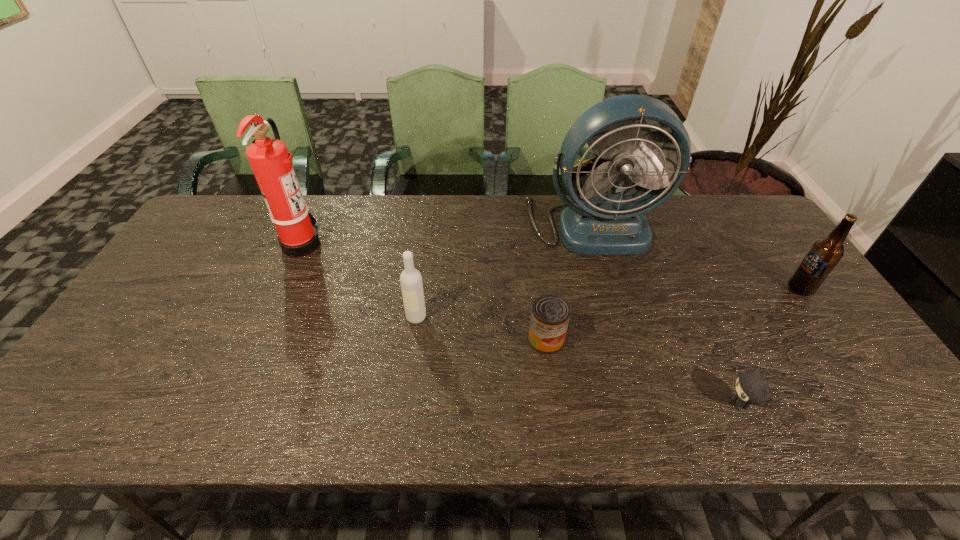
Where is `free spot located at the nozzle of the fire extinguisher`? The width and height of the screenshot is (960, 540). free spot located at the nozzle of the fire extinguisher is located at coordinates (410, 244).

What are the coordinates of `free space located 0.160m on the label of the rightmost object` in the screenshot? It's located at tap(731, 289).

This screenshot has width=960, height=540. Find the location of `blank space located 0.270m on the label of the rightmost object`. blank space located 0.270m on the label of the rightmost object is located at coordinates (691, 289).

Find the location of a particular element. The image size is (960, 540). vacant space positioned on the label of the rightmost object is located at coordinates (688, 289).

Locate an element on the screen. This screenshot has width=960, height=540. vacant space located 0.280m on the back of the fourth farthest object is located at coordinates (426, 241).

Locate an element on the screen. This screenshot has height=540, width=960. free space located on the front of the fifth farthest object is located at coordinates (558, 428).

Find the location of a particular element. The width and height of the screenshot is (960, 540). vacant area situated 0.130m on the front-facing side of the nearest object is located at coordinates (668, 404).

You are a GUI agent. You are given a task and a screenshot of the screen. Output one action in this format:
    pyautogui.click(x=<x>, y=<y>)
    Task: Click on the vacant space positioned 0.400m on the front-facing side of the nearest object
    The height and width of the screenshot is (540, 960).
    Given the screenshot: What is the action you would take?
    pyautogui.click(x=547, y=404)

This screenshot has width=960, height=540. In order to click on vacant space located on the front-facing side of the nearest object in this screenshot , I will do `click(641, 404)`.

At what (x,y) coordinates should I click in order to perform the action: click on fan that is at the far edge. Please return your answer as a coordinate pair (x, y). Image resolution: width=960 pixels, height=540 pixels. Looking at the image, I should click on (599, 223).